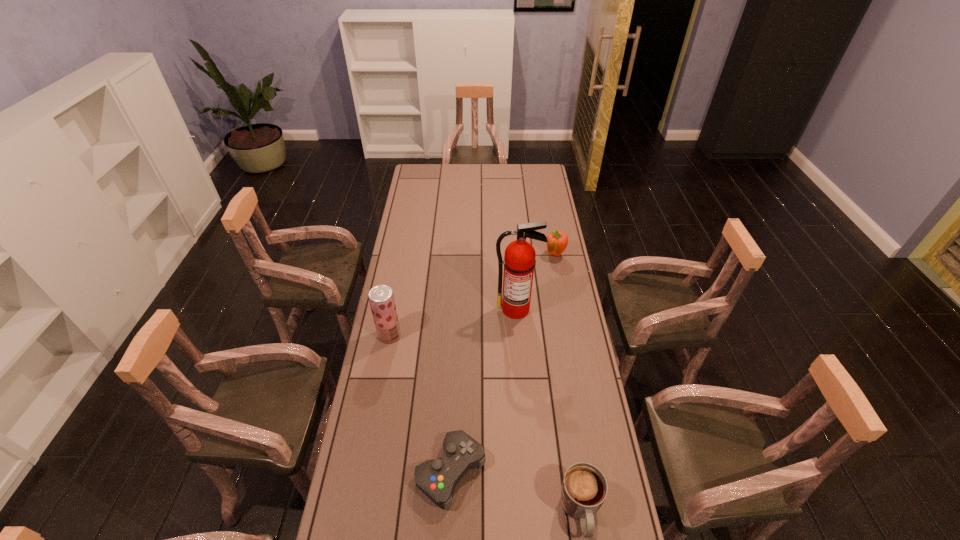
Where is `free space between the farthest object and the fire extinguisher`? free space between the farthest object and the fire extinguisher is located at coordinates (536, 282).

Identify the location of free spot between the pepper and the fourth nearest object. This screenshot has height=540, width=960. (536, 282).

Identify the location of free point between the fourth shortest object and the control. The height and width of the screenshot is (540, 960). [x=420, y=403].

Where is `vacant space that's between the control and the fire extinguisher`? vacant space that's between the control and the fire extinguisher is located at coordinates (484, 390).

Where is `vacant space in between the pepper and the third nearest object`? The height and width of the screenshot is (540, 960). vacant space in between the pepper and the third nearest object is located at coordinates (472, 295).

Find the location of a particular element. The height and width of the screenshot is (540, 960). free spot between the third tallest object and the tallest object is located at coordinates (536, 282).

Where is `vacant space in between the tallest object and the pepper`? vacant space in between the tallest object and the pepper is located at coordinates (536, 282).

Select which object is the third closest to the third shortest object. Please provide its 2D coordinates. Your answer should be formatted as a tuple, i.e. [(x, y)], where the tuple contains the x and y coordinates of a point satisfying the conditions above.

[(437, 478)]

Locate which object is the second closest to the pepper. Please provide its 2D coordinates. Your answer should be formatted as a tuple, i.e. [(x, y)], where the tuple contains the x and y coordinates of a point satisfying the conditions above.

[(381, 298)]